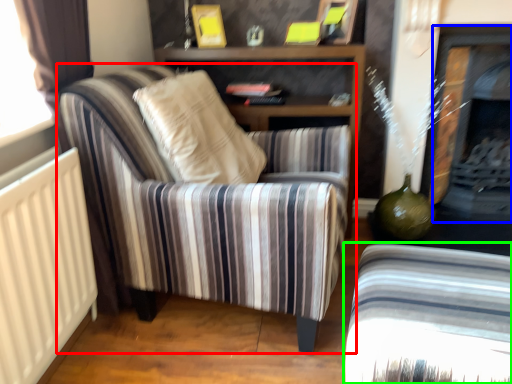
Question: Based on their relative distances, which object is farther from chair (highlighted by a red box)? Choose from fireplace (highlighted by a blue box) and chair (highlighted by a green box).

Choices:
 (A) fireplace
 (B) chair

Answer: (A)